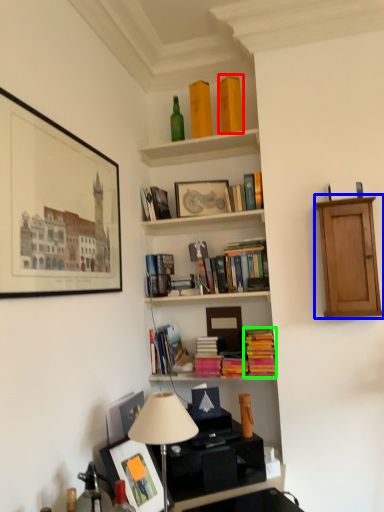
Question: Estimate the real-world distances between objects in this image. Which object is farther from book (highlighted by a red box), cabinetry (highlighted by a blue box) or book (highlighted by a green box)?

Choices:
 (A) cabinetry
 (B) book

Answer: (B)